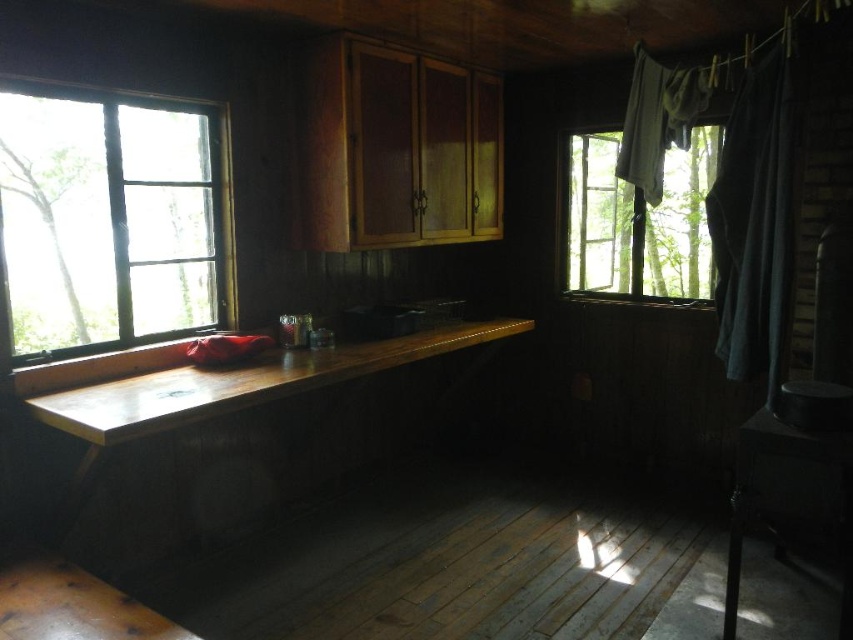
Is gray fabric curtain at right bigger than transparent glass window at upper right?

No.

The height and width of the screenshot is (640, 853). What do you see at coordinates (753, 224) in the screenshot?
I see `gray fabric curtain at right` at bounding box center [753, 224].

The image size is (853, 640). What are the coordinates of `gray fabric curtain at right` in the screenshot? It's located at (753, 224).

Does point (126, 150) come closer to viewer compared to point (677, 204)?

Yes, point (126, 150) is in front of point (677, 204).

Is point (125, 330) farther from camera compared to point (672, 211)?

No, it is not.

Locate an element on the screen. This screenshot has height=640, width=853. clear glass window at left is located at coordinates (112, 218).

Does clear glass window at left have a smaller size compared to gray fabric curtain at right?

No, clear glass window at left is not smaller than gray fabric curtain at right.

Is the position of clear glass window at left less distant than that of gray fabric curtain at right?

Yes, it is.

Identify the location of clear glass window at left. Image resolution: width=853 pixels, height=640 pixels. (112, 218).